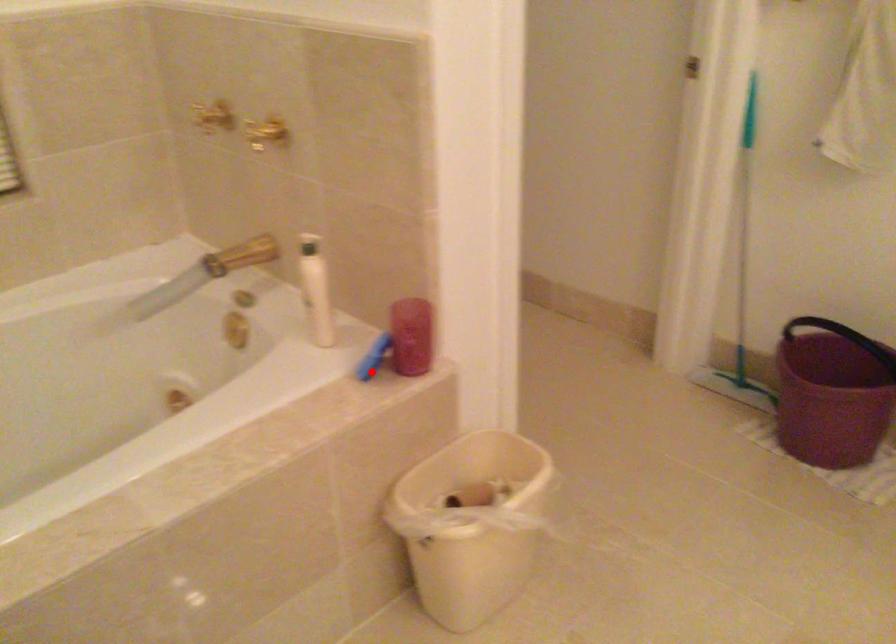
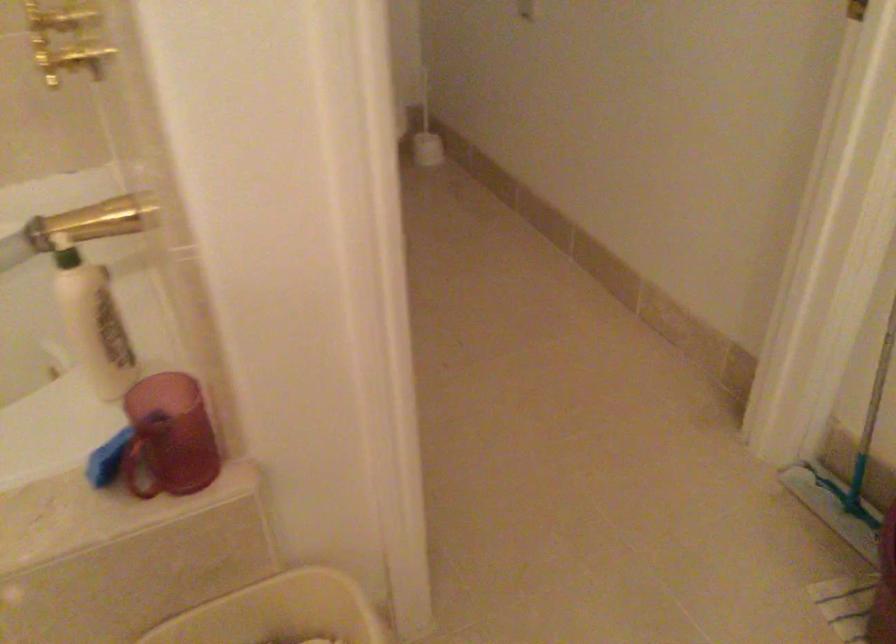
Question: I am providing you with two images of the same scene from different viewpoints. A red point is shown in image1. For the corresponding object point in image2, is it positioned nearer or farther from the camera?

Choices:
 (A) Nearer
 (B) Farther

Answer: (A)